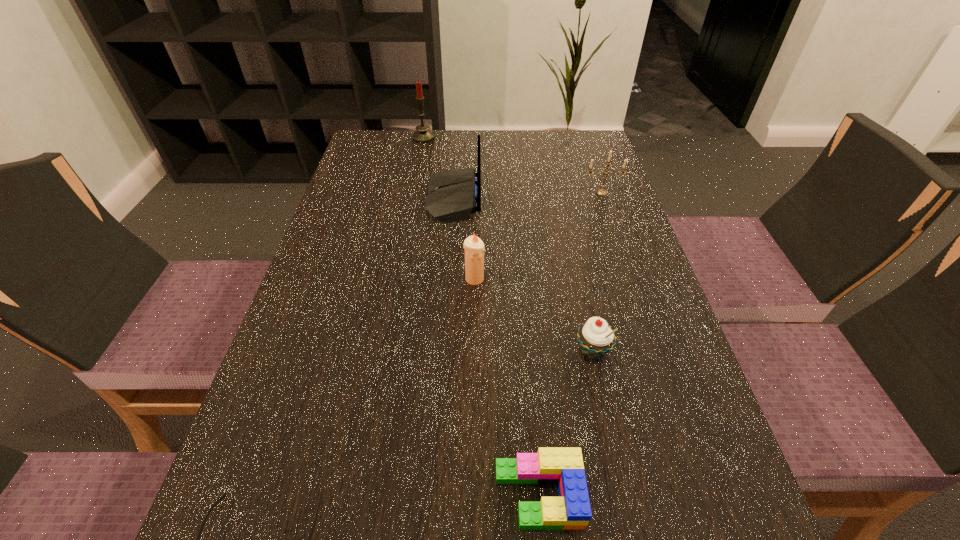
The width and height of the screenshot is (960, 540). Identify the location of Lego. (564, 466).

Where is `free region located on the right of the sixth object from right to left`? The width and height of the screenshot is (960, 540). free region located on the right of the sixth object from right to left is located at coordinates (564, 138).

Where is `vacant space located 0.170m on the back of the router`? The image size is (960, 540). vacant space located 0.170m on the back of the router is located at coordinates (547, 200).

The image size is (960, 540). I want to click on vacant space situated 0.230m on the left of the second candle from right to left, so click(x=355, y=279).

You are a GUI agent. You are given a task and a screenshot of the screen. Output one action in this format:
    pyautogui.click(x=<x>, y=<y>)
    Task: Click on the vacant region located 0.280m on the left of the second nearest candle
    The image size is (960, 540).
    Given the screenshot: What is the action you would take?
    click(x=476, y=193)

Identify the location of free spot located 0.200m on the back of the third nearest object. (573, 263).

This screenshot has width=960, height=540. What are the coordinates of `free space located 0.070m on the left of the fifth object from left to right` in the screenshot? It's located at (447, 495).

I want to click on object that is at the far edge, so click(422, 135).

You are a GUI agent. You are given a task and a screenshot of the screen. Output one action in this format:
    pyautogui.click(x=<x>, y=<y>)
    Task: Click on the object present at the left edge
    The height and width of the screenshot is (540, 960).
    Given the screenshot: What is the action you would take?
    pyautogui.click(x=422, y=135)

Where is `candle present at the right edge`? candle present at the right edge is located at coordinates (602, 192).